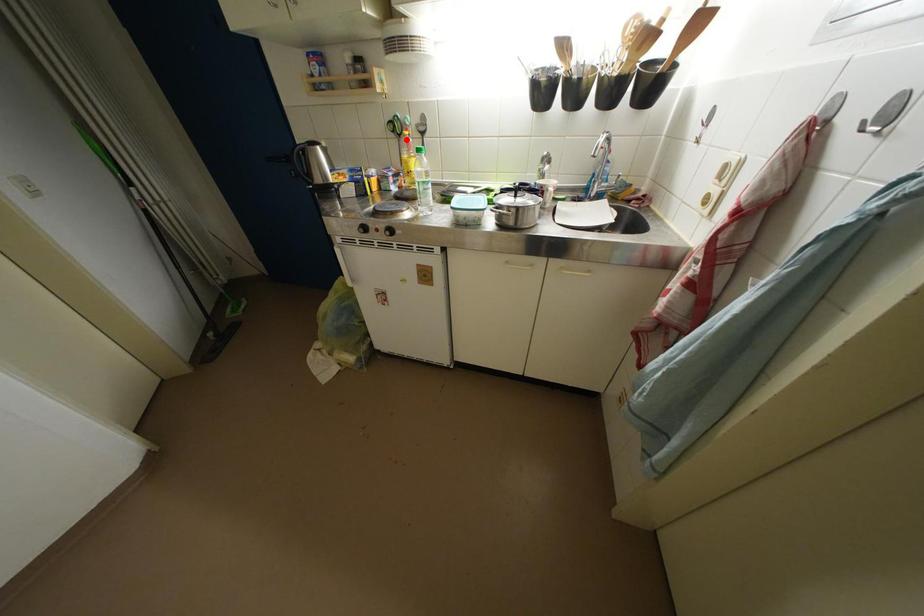
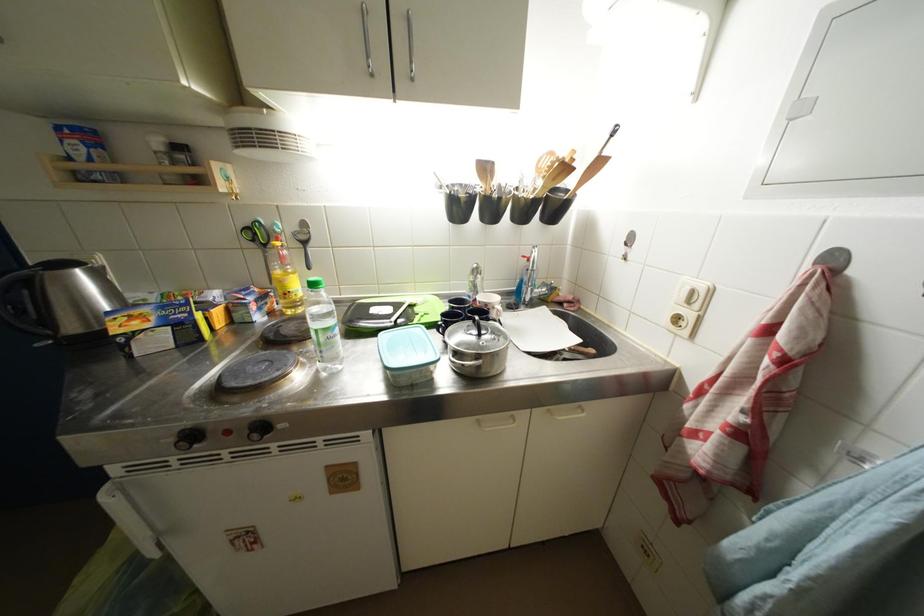
Locate, in the second image, the point that corresponds to the highlighted location in the first image.

(272, 249)